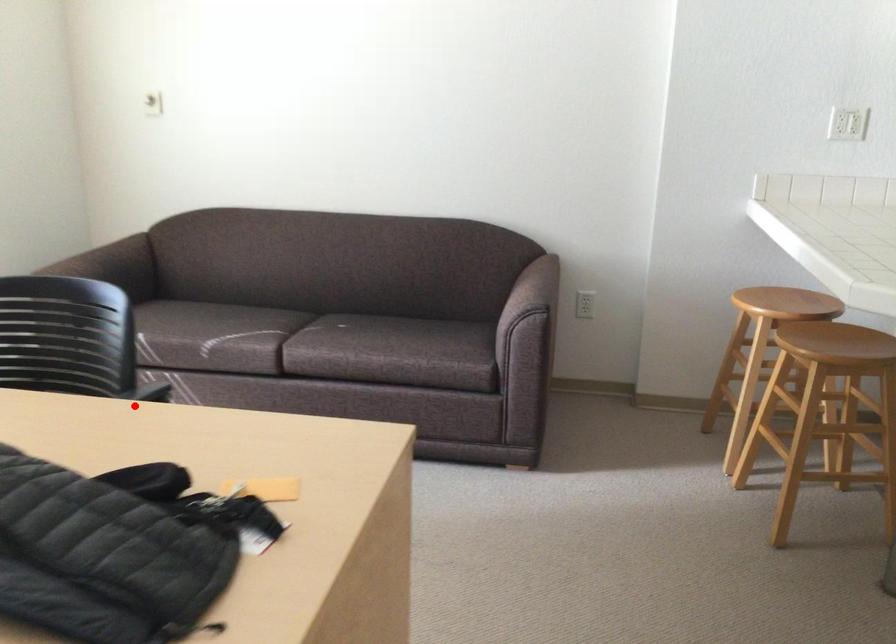
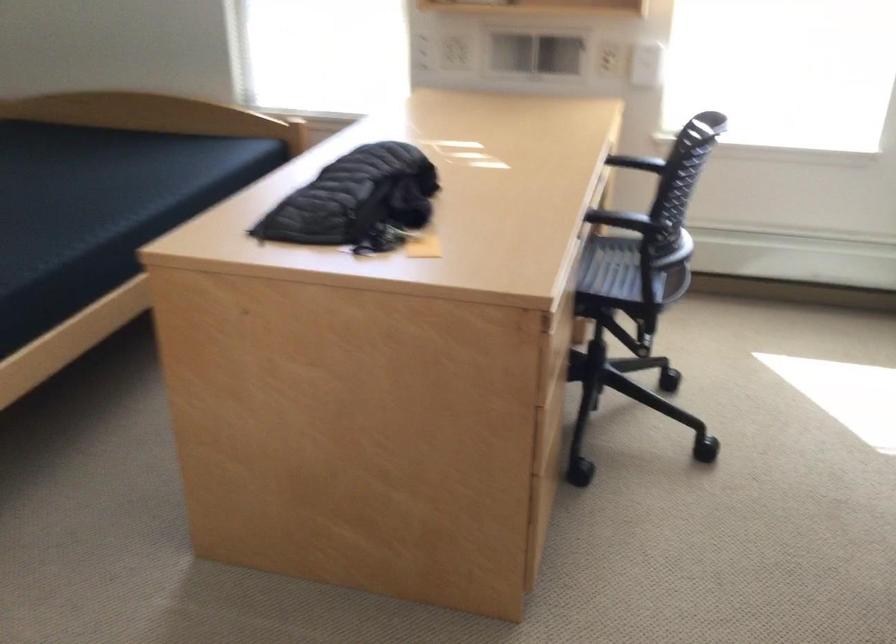
The point at the highlighted location is marked in the first image. Where is the corresponding point in the second image?

(597, 216)